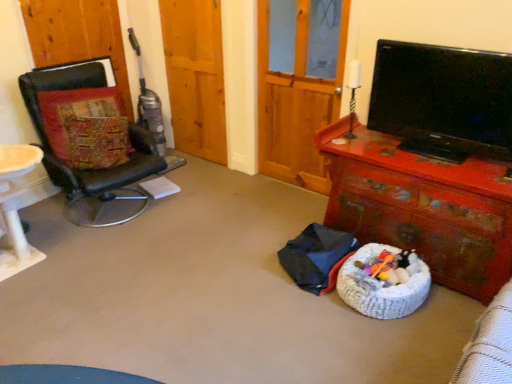
Question: Is wooden screen door at upper center, acting as the second screen door starting from the right, located within dark blue fabric at center?

Choices:
 (A) no
 (B) yes

Answer: (A)

Question: Can you confirm if dark blue fabric at center is bigger than wooden screen door at upper center, which is counted as the 1th screen door, starting from the left?

Choices:
 (A) no
 (B) yes

Answer: (B)

Question: Is dark blue fabric at center not close to wooden screen door at upper center, acting as the second screen door starting from the right?

Choices:
 (A) yes
 (B) no

Answer: (A)

Question: Is dark blue fabric at center positioned with its back to wooden screen door at upper center, which is counted as the 1th screen door, starting from the left?

Choices:
 (A) no
 (B) yes

Answer: (A)

Question: Is dark blue fabric at center in contact with wooden screen door at upper center, which is counted as the 1th screen door, starting from the left?

Choices:
 (A) no
 (B) yes

Answer: (A)

Question: In terms of size, does black leather chair at left appear bigger or smaller than textured fabric pillow at left?

Choices:
 (A) big
 (B) small

Answer: (A)

Question: Is black leather chair at left taller or shorter than textured fabric pillow at left?

Choices:
 (A) tall
 (B) short

Answer: (A)

Question: From a real-world perspective, is black leather chair at left physically located above or below textured fabric pillow at left?

Choices:
 (A) below
 (B) above

Answer: (A)

Question: Considering their positions, is black leather chair at left located in front of or behind textured fabric pillow at left?

Choices:
 (A) behind
 (B) front

Answer: (B)

Question: In the image, is wooden screen door at upper center, acting as the second screen door starting from the right, positioned in front of or behind rusty wooden desk at lower right?

Choices:
 (A) behind
 (B) front

Answer: (A)

Question: Based on their sizes in the image, would you say wooden screen door at upper center, acting as the second screen door starting from the right, is bigger or smaller than rusty wooden desk at lower right?

Choices:
 (A) big
 (B) small

Answer: (B)

Question: From the image's perspective, is wooden screen door at upper center, which is counted as the 1th screen door, starting from the left, above or below rusty wooden desk at lower right?

Choices:
 (A) below
 (B) above

Answer: (B)

Question: Is point (177, 82) closer or farther from the camera than point (379, 195)?

Choices:
 (A) closer
 (B) farther

Answer: (B)

Question: From the image's perspective, is textured fabric pillow at left above or below dark blue fabric at center?

Choices:
 (A) above
 (B) below

Answer: (A)

Question: Is textured fabric pillow at left inside the boundaries of dark blue fabric at center, or outside?

Choices:
 (A) outside
 (B) inside

Answer: (A)